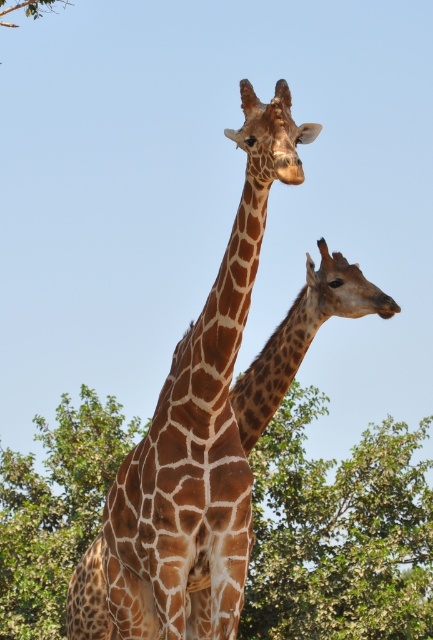
Looking at this image, you are standing in front of the image of two giraffes. There are two points marked in the image. If you want to touch the closer point to you, which point should you choose between point (x=301, y=477) and point (x=86, y=624)?

Point (x=301, y=477) is further to the viewer than point (x=86, y=624). Therefore, the closer point to you is point (x=86, y=624).

You are a photographer trying to capture a clear photo of the brown spotted giraffe at center. However, the green leafy tree at center is blocking your view. Can you move to the left or right to get a better shot without moving the tree or the giraffe?

The green leafy tree at center is closer to you than the brown spotted giraffe at center. Moving to the left or right might allow you to position yourself around the tree to capture the giraffe without obstruction.

You are a photographer trying to capture a clear shot of the brown spotted giraffe at center. However, there is a green leafy tree at center blocking part of the giraffe. To get a better view, should you move to your left or right?

The green leafy tree at center is positioned on the left side of brown spotted giraffe at center. To get a better view, you should move to your right so the tree moves out of the way.